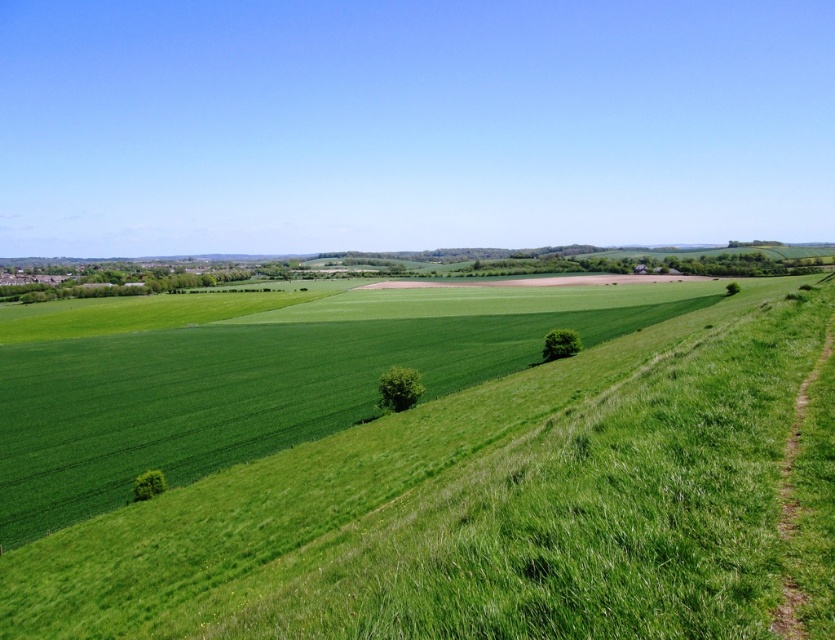
Question: Which point is farther to the camera?

Choices:
 (A) (547, 356)
 (B) (393, 387)
 (C) (155, 477)

Answer: (A)

Question: Can you confirm if green leafy tree at center is positioned to the right of green leafy tree at lower left?

Choices:
 (A) no
 (B) yes

Answer: (B)

Question: In this image, where is green leafy tree at center located relative to green leafy tree at lower left?

Choices:
 (A) below
 (B) above

Answer: (B)

Question: Does green leafy tree at center lie behind green leafy tree at lower right?

Choices:
 (A) yes
 (B) no

Answer: (B)

Question: Estimate the real-world distances between objects in this image. Which object is farther from the green leafy tree at lower right?

Choices:
 (A) green leafy tree at center
 (B) green leafy tree at lower left

Answer: (B)

Question: Which is nearer to the green leafy tree at lower left?

Choices:
 (A) green leafy tree at lower right
 (B) green leafy tree at center

Answer: (B)